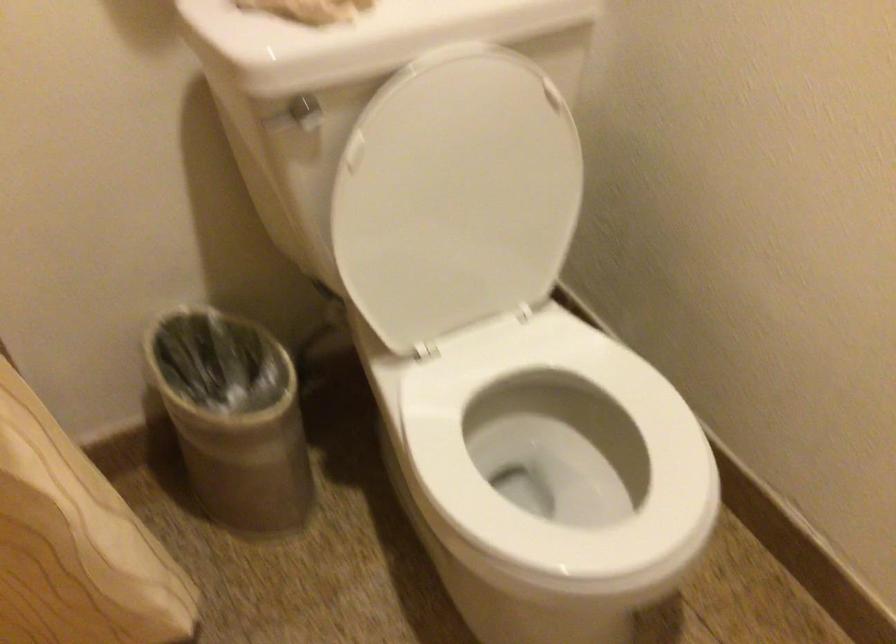
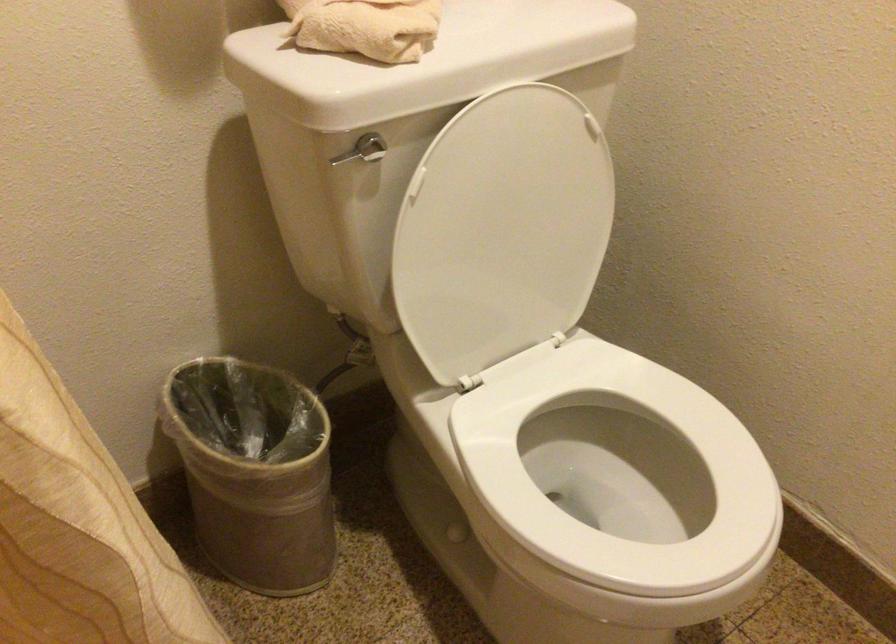
Where in the second image is the point corresponding to point (216, 422) from the first image?

(254, 471)